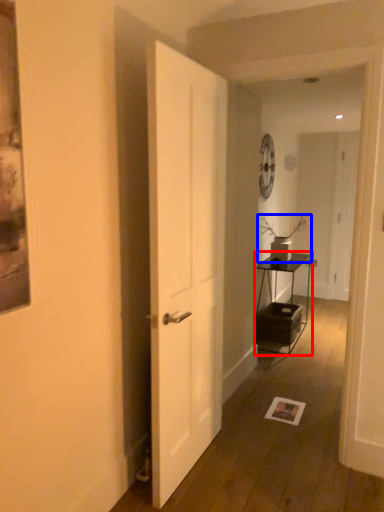
Question: Which object is closer to the camera taking this photo, table (highlighted by a red box) or houseplant (highlighted by a blue box)?

Choices:
 (A) table
 (B) houseplant

Answer: (A)